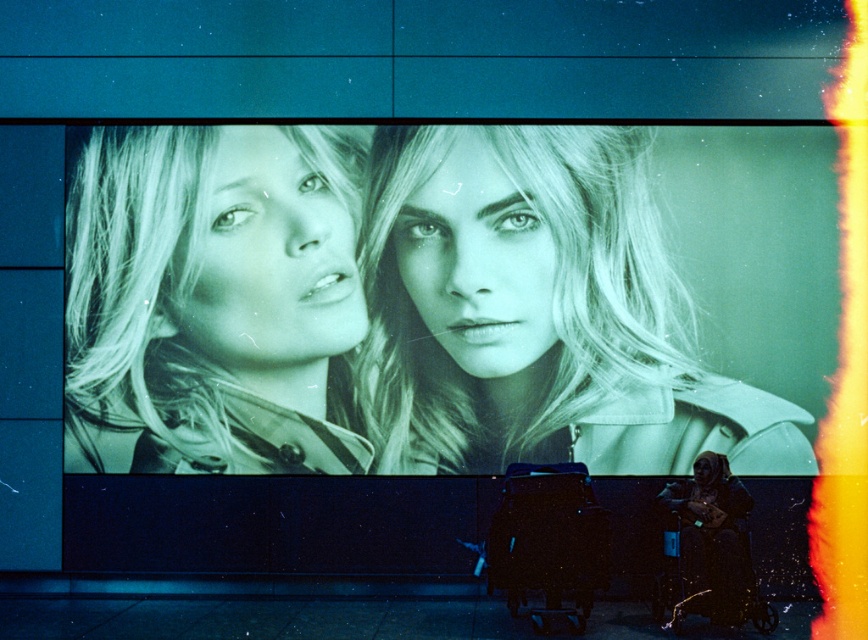
Question: Which point is farther to the camera?

Choices:
 (A) monochrome fabric at left
 (B) matte beige trench coat at center

Answer: (A)

Question: Can you confirm if matte beige trench coat at center is thinner than monochrome fabric at left?

Choices:
 (A) yes
 (B) no

Answer: (B)

Question: Can you confirm if matte beige trench coat at center is positioned to the right of monochrome fabric at left?

Choices:
 (A) yes
 (B) no

Answer: (A)

Question: Is matte beige trench coat at center positioned before monochrome fabric at left?

Choices:
 (A) no
 (B) yes

Answer: (B)